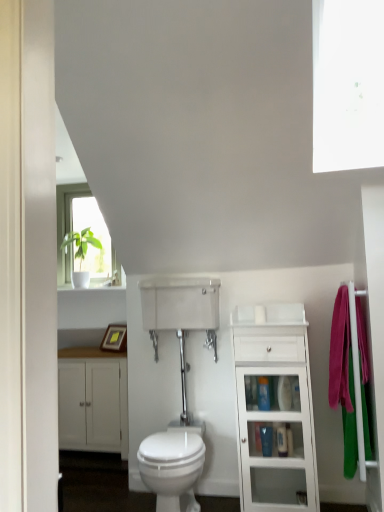
Question: Which direction should I rotate to look at blue glossy toiletry at center, which is counted as the third toiletry, starting from the bottom, — up or down?

Choices:
 (A) down
 (B) up

Answer: (A)

Question: Is white glossy medicine cabinet at center positioned beyond the bounds of blue glossy toiletry at center, which is counted as the third toiletry, starting from the bottom?

Choices:
 (A) yes
 (B) no

Answer: (A)

Question: Considering the relative positions of white glossy medicine cabinet at center and blue glossy toiletry at center, which is counted as the third toiletry, starting from the bottom, in the image provided, is white glossy medicine cabinet at center behind blue glossy toiletry at center, which is counted as the third toiletry, starting from the bottom,?

Choices:
 (A) yes
 (B) no

Answer: (A)

Question: Considering the relative sizes of white glossy medicine cabinet at center and blue glossy toiletry at center, which is counted as the third toiletry, starting from the bottom, in the image provided, is white glossy medicine cabinet at center smaller than blue glossy toiletry at center, which is counted as the third toiletry, starting from the bottom,?

Choices:
 (A) no
 (B) yes

Answer: (A)

Question: Does white glossy medicine cabinet at center have a larger size compared to blue glossy toiletry at center, which is counted as the third toiletry, starting from the bottom?

Choices:
 (A) yes
 (B) no

Answer: (A)

Question: From the image's perspective, does white glossy medicine cabinet at center appear higher than blue glossy toiletry at center, which appears as the 1th toiletry when viewed from the top?

Choices:
 (A) no
 (B) yes

Answer: (B)

Question: Is blue glossy toiletry at center, which is counted as the third toiletry, starting from the bottom, at the back of white glossy medicine cabinet at center?

Choices:
 (A) no
 (B) yes

Answer: (A)

Question: Is white glossy bidet at center located within blue glossy toiletry at center, which is counted as the third toiletry, starting from the bottom?

Choices:
 (A) no
 (B) yes

Answer: (A)

Question: Does blue glossy toiletry at center, which appears as the 1th toiletry when viewed from the top, have a smaller size compared to white glossy bidet at center?

Choices:
 (A) yes
 (B) no

Answer: (A)

Question: Does blue glossy toiletry at center, which appears as the 1th toiletry when viewed from the top, have a greater width compared to white glossy bidet at center?

Choices:
 (A) yes
 (B) no

Answer: (B)

Question: Can you confirm if blue glossy toiletry at center, which appears as the 1th toiletry when viewed from the top, is taller than white glossy bidet at center?

Choices:
 (A) yes
 (B) no

Answer: (B)

Question: From a real-world perspective, is blue glossy toiletry at center, which appears as the 1th toiletry when viewed from the top, located higher than white glossy bidet at center?

Choices:
 (A) yes
 (B) no

Answer: (A)

Question: Could you tell me if blue glossy toiletry at center, which is counted as the third toiletry, starting from the bottom, is facing white glossy bidet at center?

Choices:
 (A) no
 (B) yes

Answer: (A)

Question: From the image's perspective, is blue plastic bottle at center, which is the first toiletry from bottom to top, on white matte cabinet at lower left, the 1th bathroom cabinet from the back?

Choices:
 (A) no
 (B) yes

Answer: (B)